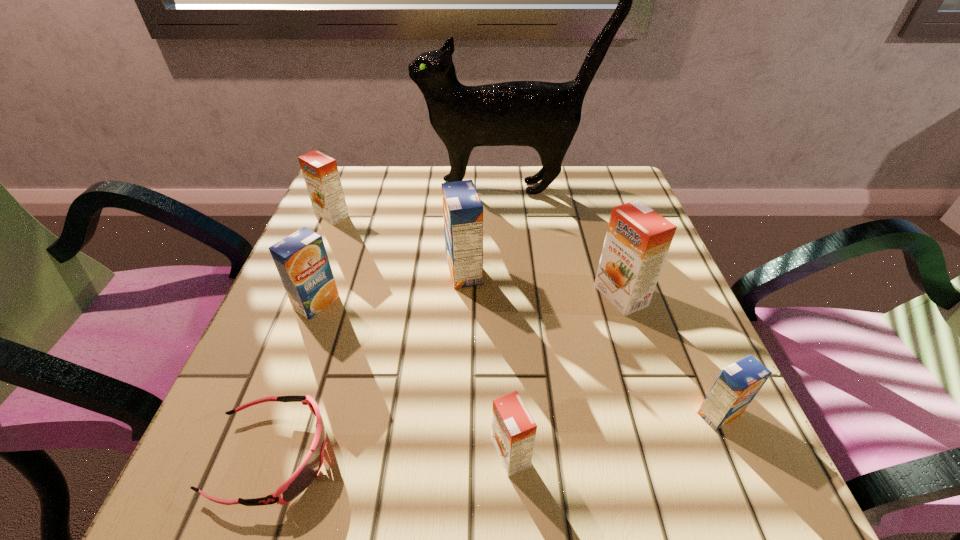
You are a GUI agent. You are given a task and a screenshot of the screen. Output one action in this format:
    pyautogui.click(x=<x>, y=<y>)
    Task: Click on the free space located 0.200m on the right of the leftmost blue orange_juice
    This screenshot has width=960, height=540.
    Given the screenshot: What is the action you would take?
    pyautogui.click(x=446, y=303)

The image size is (960, 540). I want to click on free location located on the left of the rightmost blue orange_juice, so click(x=609, y=414).

Locate an element on the screen. The height and width of the screenshot is (540, 960). free space located 0.080m on the back of the third orange juice from right to left is located at coordinates (507, 385).

Image resolution: width=960 pixels, height=540 pixels. Identify the location of vacant space situated on the front-facing side of the shortest object. (424, 456).

Find the location of a particular element. cat that is at the far edge is located at coordinates (543, 115).

Identify the location of orange juice that is at the far edge. This screenshot has height=540, width=960. (320, 172).

This screenshot has width=960, height=540. Identify the location of orange juice that is at the near edge. (513, 429).

You are a GUI agent. You are given a task and a screenshot of the screen. Output one action in this format:
    pyautogui.click(x=<x>, y=<y>)
    Task: Click on the goggles that is at the near edge
    
    Given the screenshot: What is the action you would take?
    point(304,475)

The height and width of the screenshot is (540, 960). I want to click on goggles at the left edge, so click(304, 475).

Identify the location of cat that is at the right edge. The height and width of the screenshot is (540, 960). (543, 115).